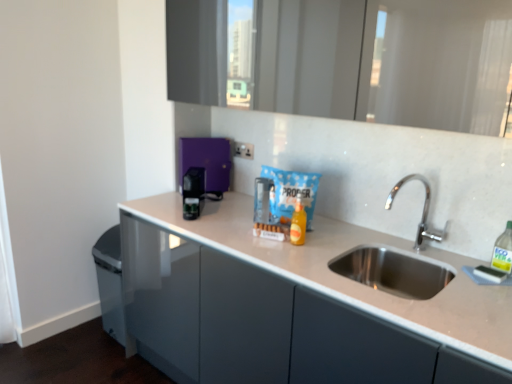
Find the location of a particular element. This screenshot has height=384, width=512. vacant point to the right of black plastic coffee machine at center, acting as the 2th appliance starting from the back is located at coordinates (228, 209).